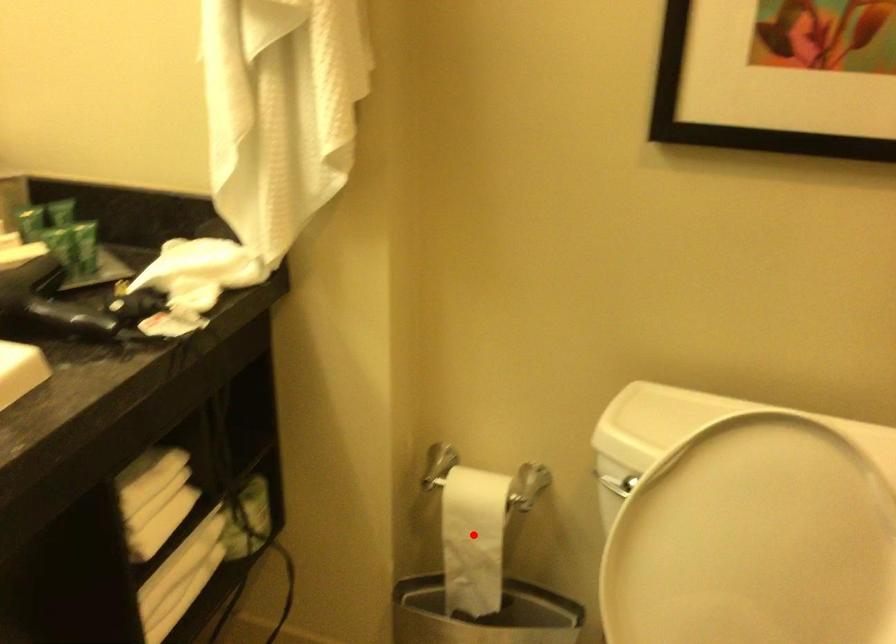
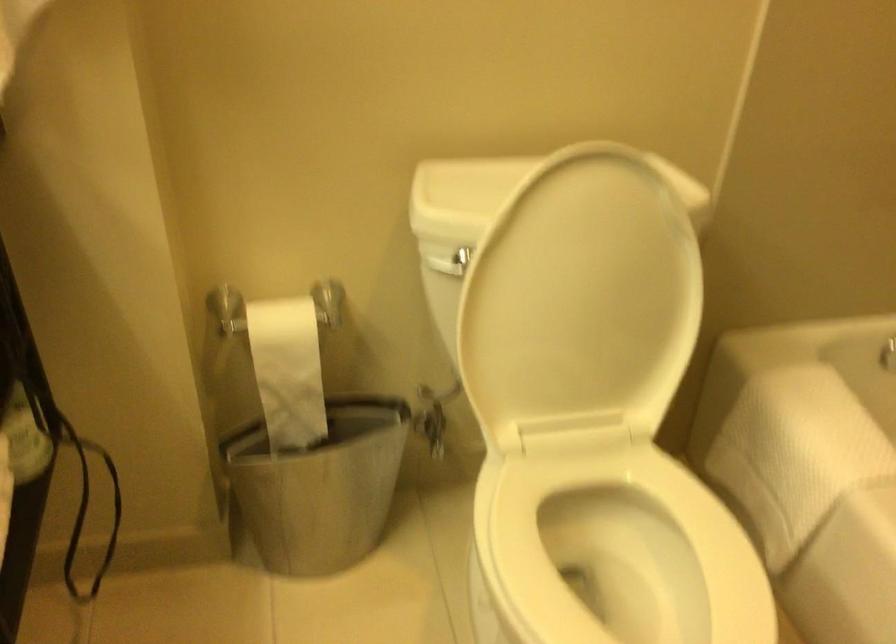
Question: I am providing you with two images of the same scene from different viewpoints. A red point is marked on the first image. Can you still see the location of the red point in image 2?

Choices:
 (A) Yes
 (B) No

Answer: (A)